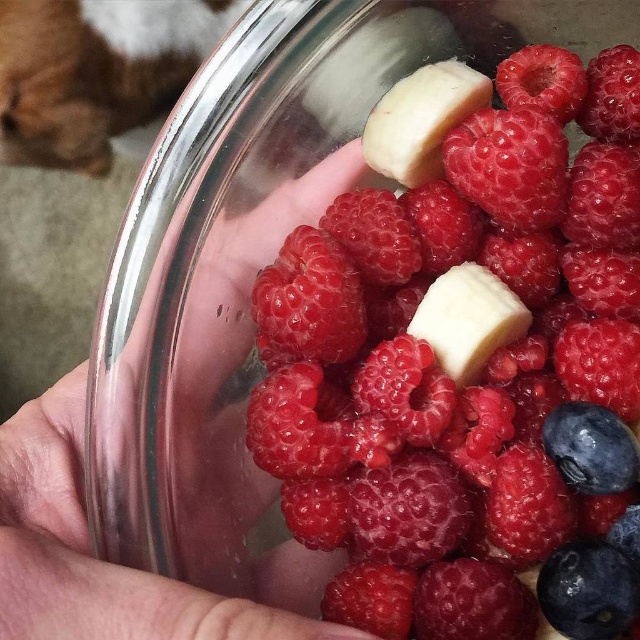
Question: Is glossy red raspberry at center wider than smooth skin hand at center?

Choices:
 (A) no
 (B) yes

Answer: (B)

Question: Can you confirm if glossy red raspberry at center is positioned to the right of smooth skin hand at center?

Choices:
 (A) no
 (B) yes

Answer: (B)

Question: Does glossy red raspberry at center have a greater width compared to smooth skin hand at center?

Choices:
 (A) yes
 (B) no

Answer: (A)

Question: Which point is closer to the camera taking this photo?

Choices:
 (A) (10, 448)
 (B) (476, 157)

Answer: (A)

Question: Which point is closer to the camera?

Choices:
 (A) (474, 173)
 (B) (49, 408)

Answer: (B)